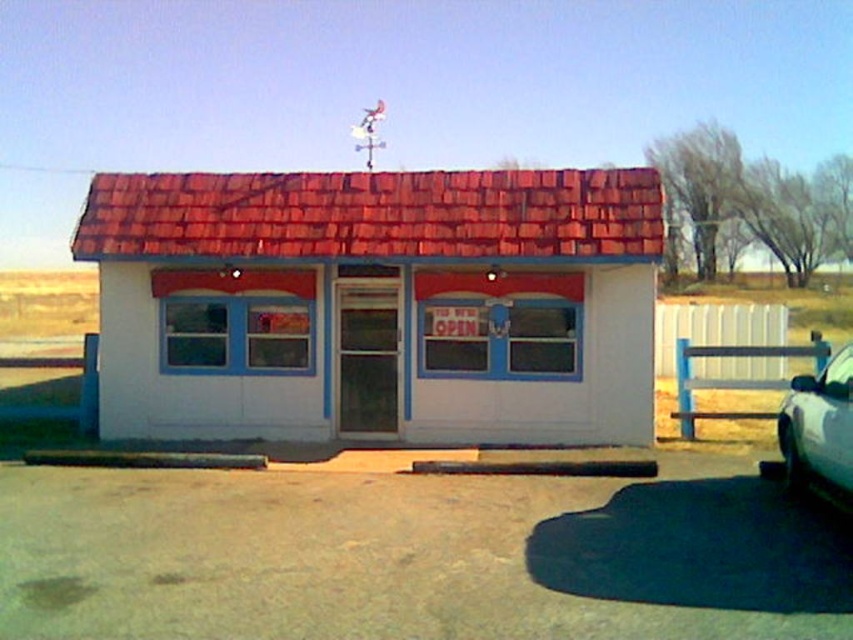
Who is shorter, white painted wood shed at center or silver metallic car at lower right?

white painted wood shed at center is shorter.

Who is more distant from viewer, (97, 220) or (840, 500)?

Point (97, 220)

Who is more distant from viewer, (619, 396) or (790, 474)?

Positioned behind is point (619, 396).

The image size is (853, 640). I want to click on white painted wood shed at center, so click(376, 305).